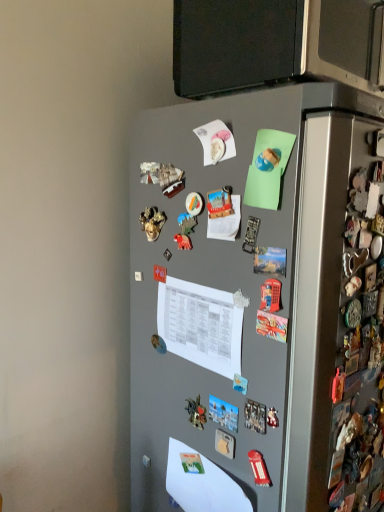
Question: Could you tell me if satin black microwave at upper center is facing white paper at center, which is the second paper in bottom-to-top order?

Choices:
 (A) yes
 (B) no

Answer: (B)

Question: Considering the relative sizes of satin black microwave at upper center and white paper at center, positioned as the first paper in top-to-bottom order, in the image provided, is satin black microwave at upper center shorter than white paper at center, positioned as the first paper in top-to-bottom order,?

Choices:
 (A) yes
 (B) no

Answer: (B)

Question: Is satin black microwave at upper center further to the viewer compared to white paper at center, positioned as the first paper in top-to-bottom order?

Choices:
 (A) yes
 (B) no

Answer: (B)

Question: From the image's perspective, is satin black microwave at upper center below white paper at center, which is the second paper in bottom-to-top order?

Choices:
 (A) yes
 (B) no

Answer: (B)

Question: Is satin black microwave at upper center at the left side of white paper at center, which is the second paper in bottom-to-top order?

Choices:
 (A) no
 (B) yes

Answer: (A)

Question: Do you think gray matte refrigerator at center is within white paper at center, positioned as the first paper in top-to-bottom order, or outside of it?

Choices:
 (A) inside
 (B) outside

Answer: (B)

Question: Is point (327, 451) positioned closer to the camera than point (221, 373)?

Choices:
 (A) farther
 (B) closer

Answer: (B)

Question: Considering the positions of gray matte refrigerator at center and white paper at center, positioned as the first paper in top-to-bottom order, in the image, is gray matte refrigerator at center bigger or smaller than white paper at center, positioned as the first paper in top-to-bottom order,?

Choices:
 (A) big
 (B) small

Answer: (A)

Question: Would you say gray matte refrigerator at center is to the left or to the right of white paper at center, positioned as the first paper in top-to-bottom order, in the picture?

Choices:
 (A) right
 (B) left

Answer: (A)

Question: From a real-world perspective, relative to gray matte refrigerator at center, is white paper at center, positioned as the first paper in top-to-bottom order, vertically above or below?

Choices:
 (A) below
 (B) above

Answer: (B)

Question: Considering the relative positions of white paper at center, which is the second paper in bottom-to-top order, and gray matte refrigerator at center in the image provided, is white paper at center, which is the second paper in bottom-to-top order, to the left or to the right of gray matte refrigerator at center?

Choices:
 (A) left
 (B) right

Answer: (A)

Question: Looking at their shapes, would you say white paper at center, which is the second paper in bottom-to-top order, is wider or thinner than gray matte refrigerator at center?

Choices:
 (A) wide
 (B) thin

Answer: (B)

Question: From the image's perspective, is white paper at center, which is the second paper in bottom-to-top order, above or below gray matte refrigerator at center?

Choices:
 (A) above
 (B) below

Answer: (A)

Question: Is satin black microwave at upper center taller or shorter than white paper at center, which is the second paper in bottom-to-top order?

Choices:
 (A) tall
 (B) short

Answer: (A)

Question: Is satin black microwave at upper center situated inside white paper at center, which is the second paper in bottom-to-top order, or outside?

Choices:
 (A) inside
 (B) outside

Answer: (B)